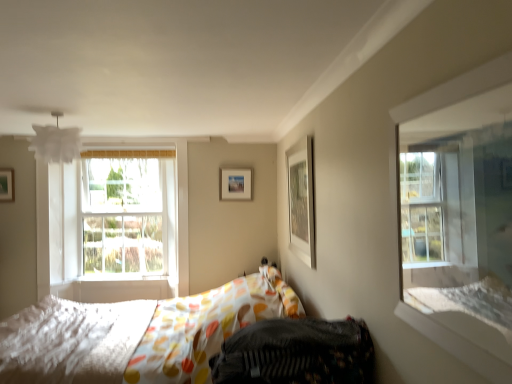
Question: Considering the relative sizes of clear glass window at upper right and patterned fabric bed at center in the image provided, is clear glass window at upper right bigger than patterned fabric bed at center?

Choices:
 (A) yes
 (B) no

Answer: (B)

Question: From a real-world perspective, is clear glass window at upper right on top of patterned fabric bed at center?

Choices:
 (A) no
 (B) yes

Answer: (B)

Question: Is the depth of clear glass window at upper right less than that of patterned fabric bed at center?

Choices:
 (A) yes
 (B) no

Answer: (A)

Question: From a real-world perspective, is clear glass window at upper right located beneath patterned fabric bed at center?

Choices:
 (A) no
 (B) yes

Answer: (A)

Question: Is clear glass window at upper right oriented away from patterned fabric bed at center?

Choices:
 (A) no
 (B) yes

Answer: (A)

Question: Is clear glass window at upper right situated inside patterned fabric bed at center or outside?

Choices:
 (A) inside
 (B) outside

Answer: (B)

Question: Looking at the image, does clear glass window at upper right seem bigger or smaller compared to patterned fabric bed at center?

Choices:
 (A) big
 (B) small

Answer: (B)

Question: From the image's perspective, is clear glass window at upper right located above or below patterned fabric bed at center?

Choices:
 (A) below
 (B) above

Answer: (B)

Question: From their relative heights in the image, would you say clear glass window at upper right is taller or shorter than patterned fabric bed at center?

Choices:
 (A) short
 (B) tall

Answer: (A)

Question: Considering the positions of white textured mattress at lower left and clear glass window at upper right in the image, is white textured mattress at lower left wider or thinner than clear glass window at upper right?

Choices:
 (A) thin
 (B) wide

Answer: (B)

Question: Visually, is white textured mattress at lower left positioned to the left or to the right of clear glass window at upper right?

Choices:
 (A) left
 (B) right

Answer: (A)

Question: From a real-world perspective, is white textured mattress at lower left positioned above or below clear glass window at upper right?

Choices:
 (A) below
 (B) above

Answer: (A)

Question: Is white textured mattress at lower left taller or shorter than clear glass window at upper right?

Choices:
 (A) tall
 (B) short

Answer: (B)

Question: In the image, is matte white picture frame at upper right, placed as the first picture frame when sorted from front to back, positioned in front of or behind matte wooden picture frame at center, which appears as the 1th picture frame when viewed from the back?

Choices:
 (A) front
 (B) behind

Answer: (A)

Question: Based on their sizes in the image, would you say matte white picture frame at upper right, placed as the first picture frame when sorted from front to back, is bigger or smaller than matte wooden picture frame at center, the 2th picture frame viewed from the left?

Choices:
 (A) small
 (B) big

Answer: (B)